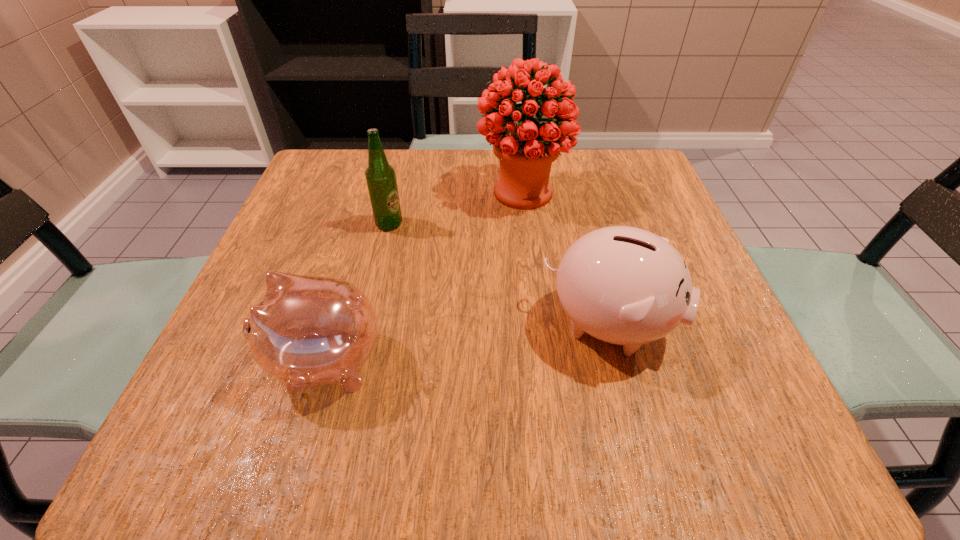
This screenshot has height=540, width=960. Find the location of `object that is the second closest one to the beer bottle`. object that is the second closest one to the beer bottle is located at coordinates (307, 331).

This screenshot has height=540, width=960. Find the location of `object that ranks as the closest to the right piggy bank`. object that ranks as the closest to the right piggy bank is located at coordinates (526, 151).

At what (x,y) coordinates should I click in order to perform the action: click on free region that satisfies the following two spatial constraints: 1. on the label of the right piggy bank; 2. on the right side of the beer bottle. Please return your answer as a coordinate pair (x, y). Looking at the image, I should click on (366, 324).

The image size is (960, 540). I want to click on free location that satisfies the following two spatial constraints: 1. on the label of the beer bottle; 2. on the right side of the right piggy bank, so click(x=366, y=324).

Identify the location of blank area in the image that satisfies the following two spatial constraints: 1. on the label of the beer bottle; 2. on the back side of the right piggy bank. The image size is (960, 540). (366, 324).

In order to click on vacant point that satisfies the following two spatial constraints: 1. on the label of the beer bottle; 2. on the back side of the right piggy bank in this screenshot , I will do `click(366, 324)`.

Image resolution: width=960 pixels, height=540 pixels. I want to click on free point that satisfies the following two spatial constraints: 1. on the label of the right piggy bank; 2. on the left side of the beer bottle, so click(366, 324).